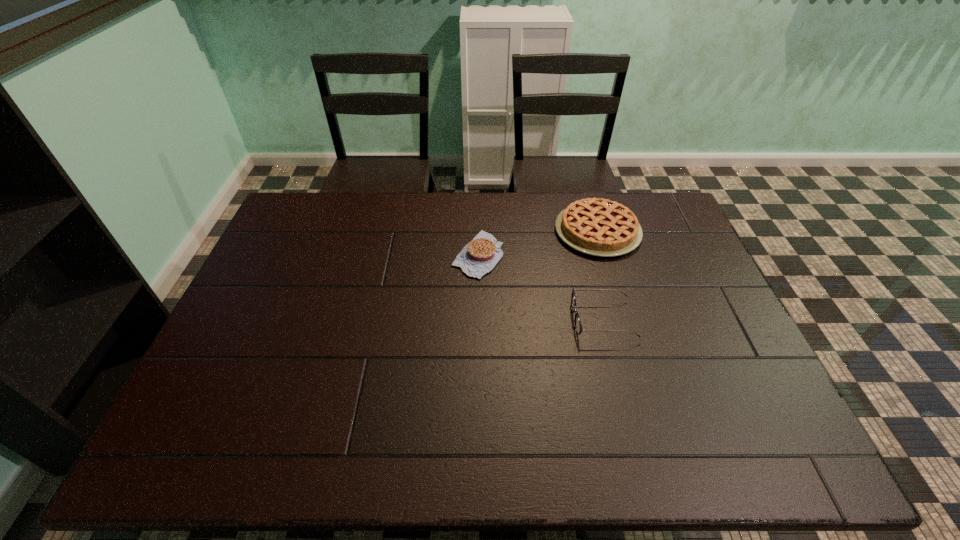
What are the coordinates of `unoccupied position between the taller pie and the shortest object` in the screenshot? It's located at (538, 243).

Image resolution: width=960 pixels, height=540 pixels. In order to click on free space between the left pie and the taller pie in this screenshot , I will do `click(538, 243)`.

Where is `vacant area that lies between the right pie and the spectacles`? vacant area that lies between the right pie and the spectacles is located at coordinates (600, 275).

Where is `vacant area between the shorter pie and the taller pie`? The height and width of the screenshot is (540, 960). vacant area between the shorter pie and the taller pie is located at coordinates (538, 243).

Find the location of a particular element. The height and width of the screenshot is (540, 960). vacant space that is in between the right pie and the leftmost object is located at coordinates (538, 243).

Select which object is the second closest to the spectacles. Please provide its 2D coordinates. Your answer should be formatted as a tuple, i.e. [(x, y)], where the tuple contains the x and y coordinates of a point satisfying the conditions above.

[(478, 257)]

Locate which object ranks second in proximity to the left pie. Please provide its 2D coordinates. Your answer should be formatted as a tuple, i.e. [(x, y)], where the tuple contains the x and y coordinates of a point satisfying the conditions above.

[(578, 327)]

The image size is (960, 540). Identify the location of free space that satisfies the following two spatial constraints: 1. on the back side of the taller pie; 2. on the left side of the shortest object. (478, 231).

Find the location of a particular element. Image resolution: width=960 pixels, height=540 pixels. blank space that satisfies the following two spatial constraints: 1. on the front side of the right pie; 2. through the lenses of the nearest object is located at coordinates (624, 320).